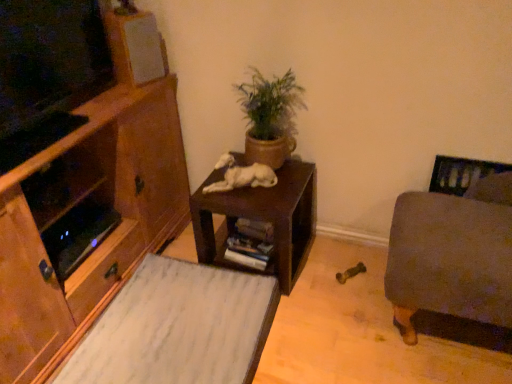
Identify the location of free spot below white fur dog at center (from a real-world perspective). Image resolution: width=512 pixels, height=384 pixels. pos(241,183).